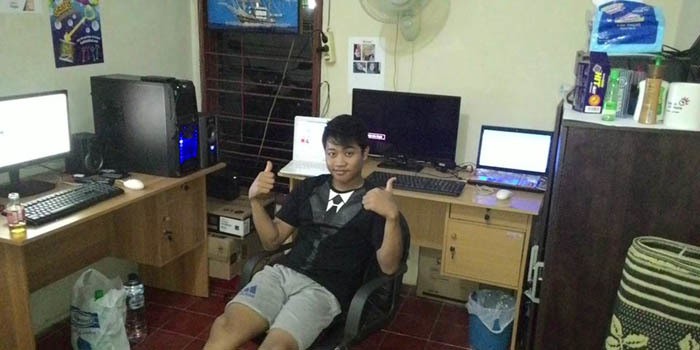
Where is `fan`? This screenshot has height=350, width=700. fan is located at coordinates (398, 14).